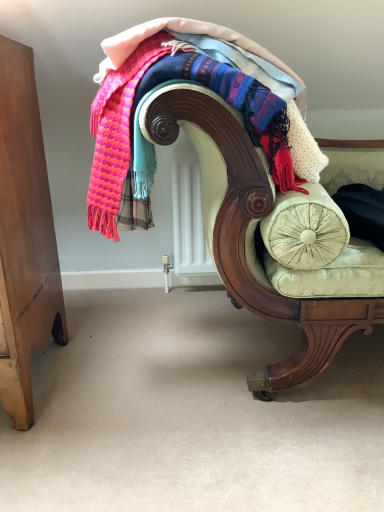
What do you see at coordinates (245, 237) in the screenshot? I see `velvet green chaise at center` at bounding box center [245, 237].

Find the location of a particular element. velvet green chaise at center is located at coordinates (245, 237).

Locate an element on the screen. This screenshot has height=512, width=384. knitted wool scarf at upper center is located at coordinates (198, 82).

What do you see at coordinates (198, 82) in the screenshot? The image size is (384, 512). I see `knitted wool scarf at upper center` at bounding box center [198, 82].

In order to face knitted wool scarf at upper center, should I rotate leftwards or rightwards?

Rotate your view left by about 0.138°.

At what (x,y) coordinates should I click in order to perform the action: click on velvet green chaise at center. Please return your answer as a coordinate pair (x, y). Looking at the image, I should click on (245, 237).

Consider the image. Can you confirm if velvet green chaise at center is positioned to the left of knitted wool scarf at upper center?

No.

Which object is closer to the camera, velvet green chaise at center or knitted wool scarf at upper center?

Positioned in front is velvet green chaise at center.

Between point (249, 290) and point (118, 65), which one is positioned in front?

The point (118, 65) is closer.

From the image's perspective, is velvet green chaise at center on top of knitted wool scarf at upper center?

No, from the image's perspective, velvet green chaise at center is not over knitted wool scarf at upper center.

From a real-world perspective, which object stands above the other?

From a 3D spatial view, knitted wool scarf at upper center is above.

Considering the sizes of velvet green chaise at center and knitted wool scarf at upper center in the image, is velvet green chaise at center wider or thinner than knitted wool scarf at upper center?

velvet green chaise at center is wider than knitted wool scarf at upper center.

Between velvet green chaise at center and knitted wool scarf at upper center, which one has less height?

With less height is knitted wool scarf at upper center.

Is velvet green chaise at center bigger than knitted wool scarf at upper center?

Yes, velvet green chaise at center is bigger than knitted wool scarf at upper center.

Is knitted wool scarf at upper center inside velvet green chaise at center?

Indeed, knitted wool scarf at upper center is located within velvet green chaise at center.

Is there a large distance between velvet green chaise at center and knitted wool scarf at upper center?

velvet green chaise at center is actually quite close to knitted wool scarf at upper center.

Is velvet green chaise at center facing away from knitted wool scarf at upper center?

velvet green chaise at center does not have its back to knitted wool scarf at upper center.

How many degrees apart are the facing directions of velvet green chaise at center and knitted wool scarf at upper center?

The angle between the facing direction of velvet green chaise at center and the facing direction of knitted wool scarf at upper center is 10.3 degrees.

At what (x,y) coordinates should I click in order to perform the action: click on laundry above the velvet green chaise at center (from the image's perspective). Please return your answer as a coordinate pair (x, y). Looking at the image, I should click on (198, 82).

Does knitted wool scarf at upper center appear on the right side of velvet green chaise at center?

Incorrect, knitted wool scarf at upper center is not on the right side of velvet green chaise at center.

Which is in front, knitted wool scarf at upper center or velvet green chaise at center?

velvet green chaise at center is more forward.

Which point is more forward, (270, 165) or (201, 108)?

Positioned in front is point (201, 108).

From the image's perspective, which object appears higher, knitted wool scarf at upper center or velvet green chaise at center?

knitted wool scarf at upper center is shown above in the image.

From a real-world perspective, is knitted wool scarf at upper center on top of velvet green chaise at center?

Yes, from a real-world perspective, knitted wool scarf at upper center is above velvet green chaise at center.

Which object is thinner, knitted wool scarf at upper center or velvet green chaise at center?

knitted wool scarf at upper center.

From their relative heights in the image, would you say knitted wool scarf at upper center is taller or shorter than velvet green chaise at center?

Considering their sizes, knitted wool scarf at upper center has less height than velvet green chaise at center.

Which of these two, knitted wool scarf at upper center or velvet green chaise at center, is smaller?

Smaller between the two is knitted wool scarf at upper center.

Is knitted wool scarf at upper center positioned beyond the bounds of velvet green chaise at center?

No, knitted wool scarf at upper center is inside velvet green chaise at center's boundary.

Is knitted wool scarf at upper center in contact with velvet green chaise at center?

No, knitted wool scarf at upper center is not touching velvet green chaise at center.

Could you tell me if knitted wool scarf at upper center is facing velvet green chaise at center?

Yes, knitted wool scarf at upper center faces towards velvet green chaise at center.

At what (x,y) coordinates should I click in order to perform the action: click on laundry that appears behind the velvet green chaise at center. Please return your answer as a coordinate pair (x, y). This screenshot has height=512, width=384. Looking at the image, I should click on (198, 82).

This screenshot has width=384, height=512. Find the location of `laundry lying on the left of velvet green chaise at center`. laundry lying on the left of velvet green chaise at center is located at coordinates (198, 82).

Image resolution: width=384 pixels, height=512 pixels. I want to click on chair below the knitted wool scarf at upper center (from a real-world perspective), so click(x=245, y=237).